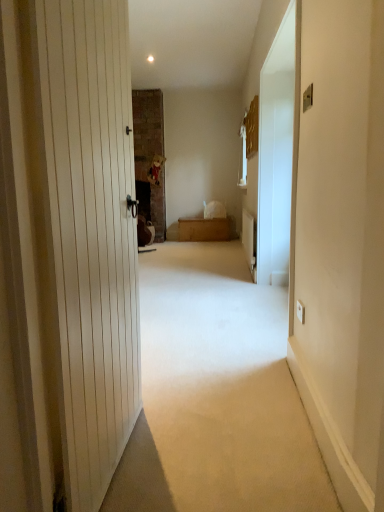
Question: Considering the relative sizes of wooden chest at center and white glossy screen door at right in the image provided, is wooden chest at center taller than white glossy screen door at right?

Choices:
 (A) yes
 (B) no

Answer: (B)

Question: From the image's perspective, is wooden chest at center above white glossy screen door at right?

Choices:
 (A) no
 (B) yes

Answer: (A)

Question: Can you confirm if wooden chest at center is bigger than white glossy screen door at right?

Choices:
 (A) no
 (B) yes

Answer: (B)

Question: Are wooden chest at center and white glossy screen door at right making contact?

Choices:
 (A) yes
 (B) no

Answer: (B)

Question: Considering the relative positions of wooden chest at center and white glossy screen door at right in the image provided, is wooden chest at center to the left of white glossy screen door at right from the viewer's perspective?

Choices:
 (A) yes
 (B) no

Answer: (A)

Question: Can you confirm if wooden chest at center is positioned to the right of white glossy screen door at right?

Choices:
 (A) yes
 (B) no

Answer: (B)

Question: Considering the relative positions of beige carpet at center and wooden chest at center in the image provided, is beige carpet at center to the left of wooden chest at center from the viewer's perspective?

Choices:
 (A) no
 (B) yes

Answer: (B)

Question: Can you confirm if beige carpet at center is positioned to the right of wooden chest at center?

Choices:
 (A) yes
 (B) no

Answer: (B)

Question: Is the position of beige carpet at center more distant than that of wooden chest at center?

Choices:
 (A) no
 (B) yes

Answer: (A)

Question: Is beige carpet at center not close to wooden chest at center?

Choices:
 (A) yes
 (B) no

Answer: (A)

Question: Is beige carpet at center facing away from wooden chest at center?

Choices:
 (A) yes
 (B) no

Answer: (B)

Question: Considering the relative sizes of beige carpet at center and wooden chest at center in the image provided, is beige carpet at center taller than wooden chest at center?

Choices:
 (A) yes
 (B) no

Answer: (B)

Question: Is white glossy screen door at right looking in the opposite direction of wooden chest at center?

Choices:
 (A) yes
 (B) no

Answer: (B)